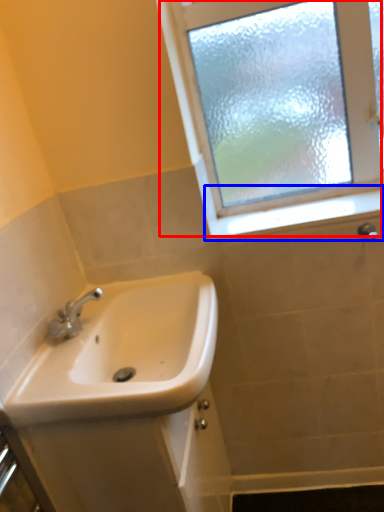
Question: Which object appears farthest to the camera in this image, window (highlighted by a red box) or window sill (highlighted by a blue box)?

Choices:
 (A) window
 (B) window sill

Answer: (B)